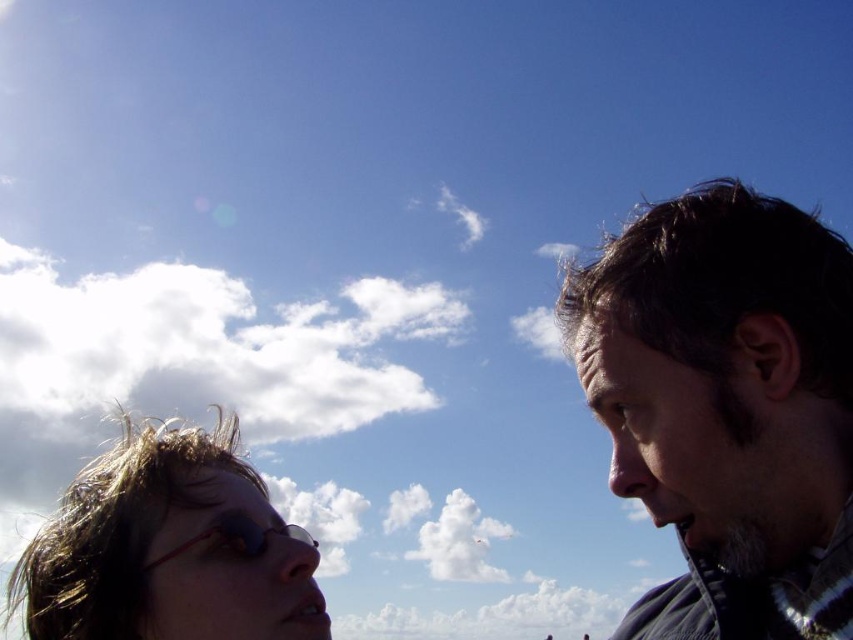
Who is positioned more to the right, dark brown hair at right or sunglasses at lower left?

From the viewer's perspective, dark brown hair at right appears more on the right side.

Does point (811, 314) lie behind point (16, 561)?

No, it is not.

At what (x,y) coordinates should I click in order to perform the action: click on dark brown hair at right. Please return your answer as a coordinate pair (x, y). Image resolution: width=853 pixels, height=640 pixels. Looking at the image, I should click on (727, 406).